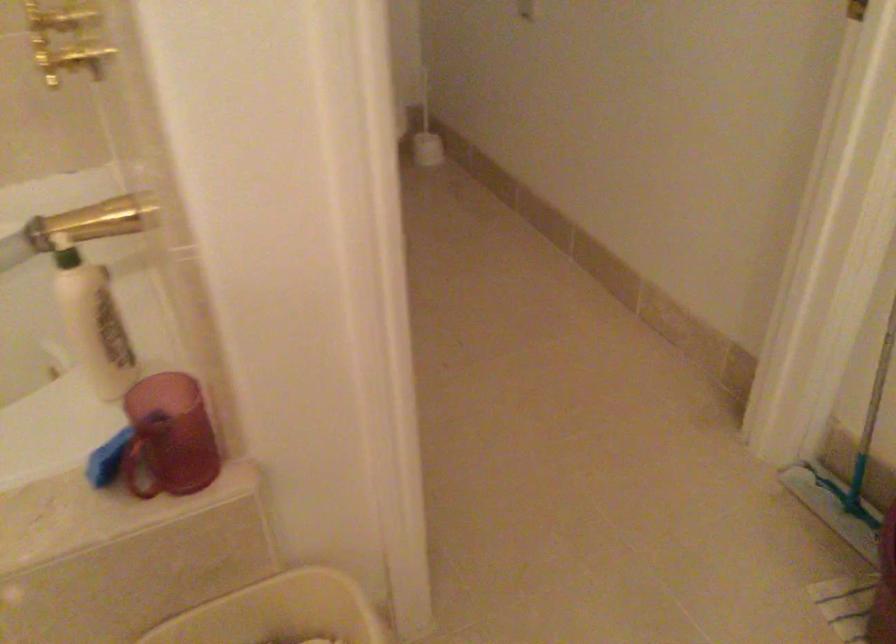
This screenshot has height=644, width=896. What do you see at coordinates (95, 222) in the screenshot?
I see `a gold faucet handle` at bounding box center [95, 222].